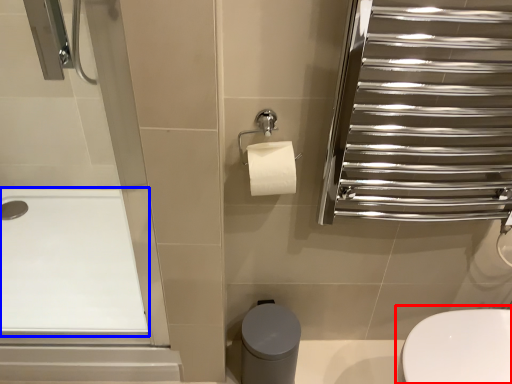
Question: Which of the following is the closest to the observer, toilet (highlighted by a red box) or bath (highlighted by a blue box)?

Choices:
 (A) toilet
 (B) bath

Answer: (A)